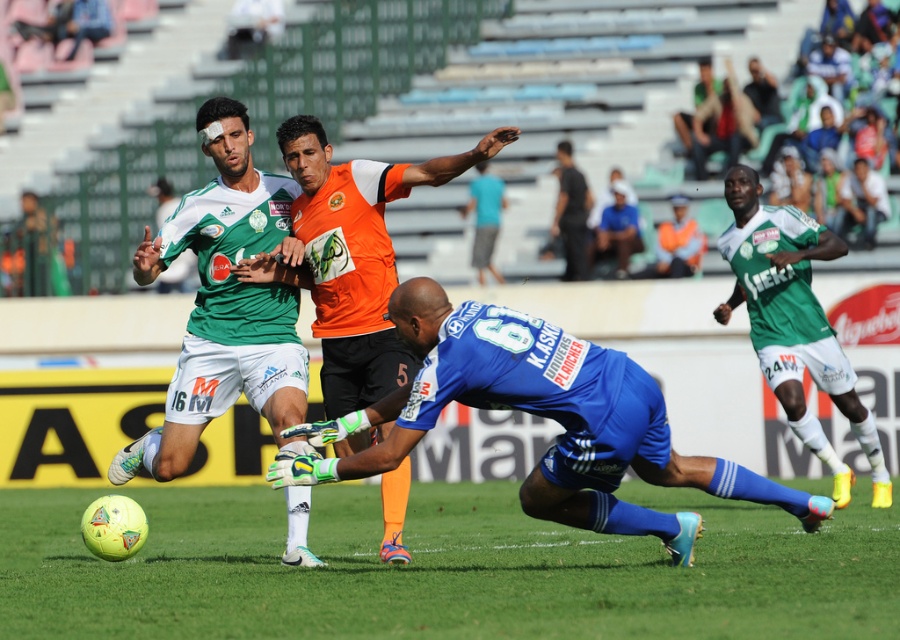
You are a soccer referee observing the play. You need to determine if the yellow matte football at center is in front of or behind the teal fabric shirt at center. What do you observe?

The yellow matte football at center is closer to the viewer than the teal fabric shirt at center, so it is in front of the teal fabric shirt at center.

You are a soccer referee observing the match. You need to determine if the yellow matte football at center is bigger than the blue jersey at center. What do you notice?

The yellow matte football at center has a larger size compared to blue jersey at center, so yes, the yellow matte football at center is bigger than the blue jersey at center.

You are a soccer referee observing the play. You notice the black matte shirt at center and the blue fabric cap at upper center. Which object is positioned to the right side of the other?

The blue fabric cap at upper center is to the right of the black matte shirt at center.